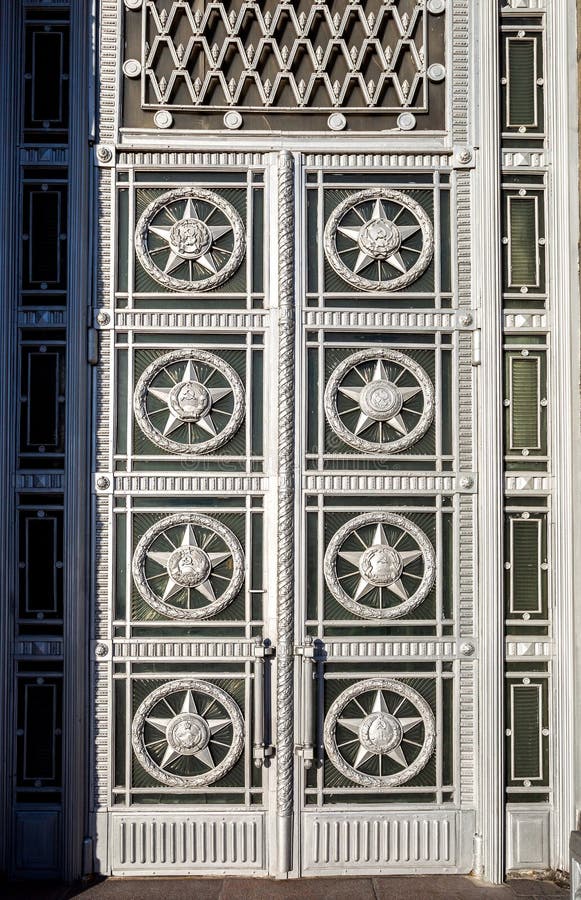
I want to click on left door handle, so (x=259, y=694).